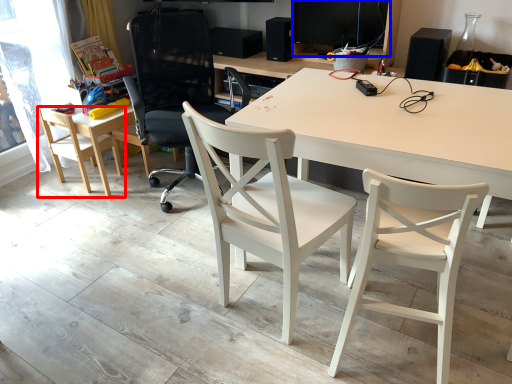
Question: Among these objects, which one is nearest to the camera, chair (highlighted by a red box) or computer monitor (highlighted by a blue box)?

Choices:
 (A) chair
 (B) computer monitor

Answer: (B)